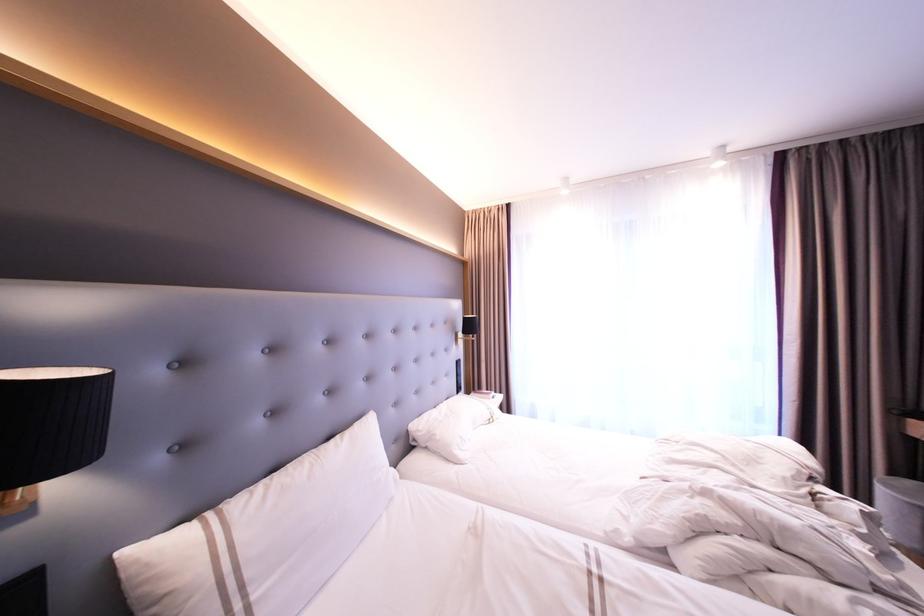
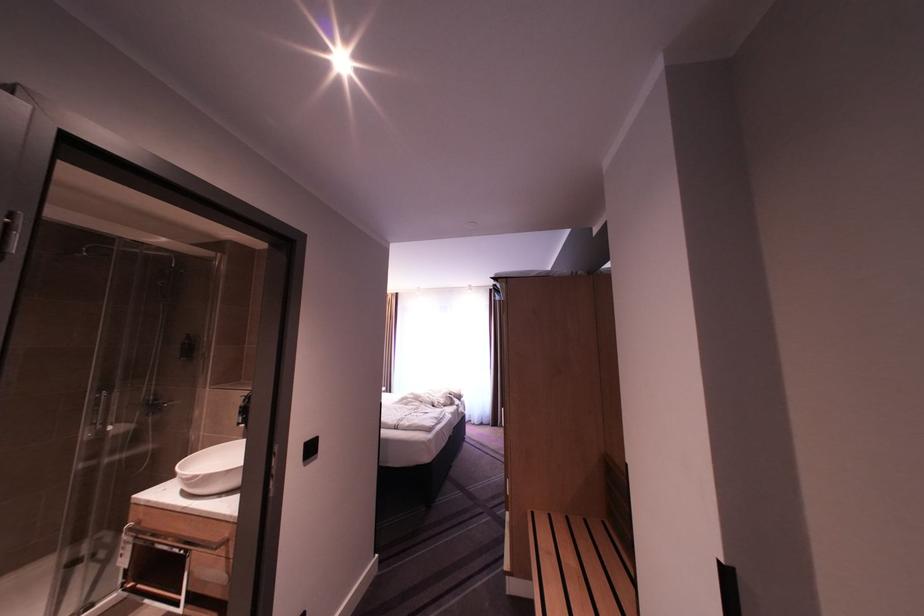
Question: What movement of the cameraman would produce the second image?

Choices:
 (A) Left
 (B) Right
 (C) Forward
 (D) Backward

Answer: (D)